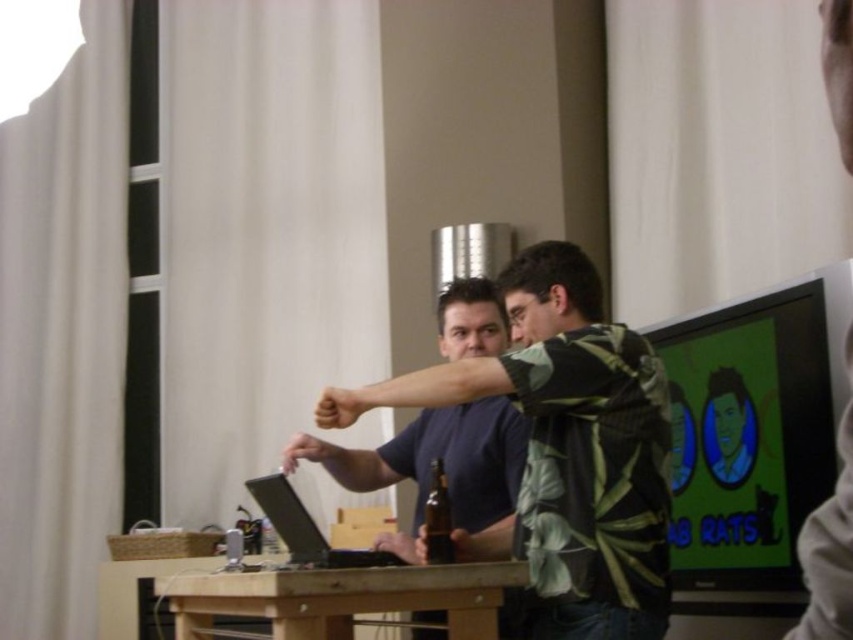
Question: Which of the following is the closest to the observer?

Choices:
 (A) (552, 630)
 (B) (432, 545)
 (C) (317, 556)

Answer: (A)

Question: Is green leafy shirt at center to the right of matte black laptop at center from the viewer's perspective?

Choices:
 (A) yes
 (B) no

Answer: (A)

Question: Where is matte black laptop at center located in relation to brown glass beer bottle at center in the image?

Choices:
 (A) above
 (B) below

Answer: (B)

Question: Which object is positioned closest to the wooden table at center?

Choices:
 (A) brown glass beer bottle at center
 (B) matte black laptop at center

Answer: (B)

Question: Which point is farther to the camera?

Choices:
 (A) 263,508
 (B) 439,488

Answer: (A)

Question: Can you confirm if green leafy shirt at center is positioned below wooden table at center?

Choices:
 (A) yes
 (B) no

Answer: (B)